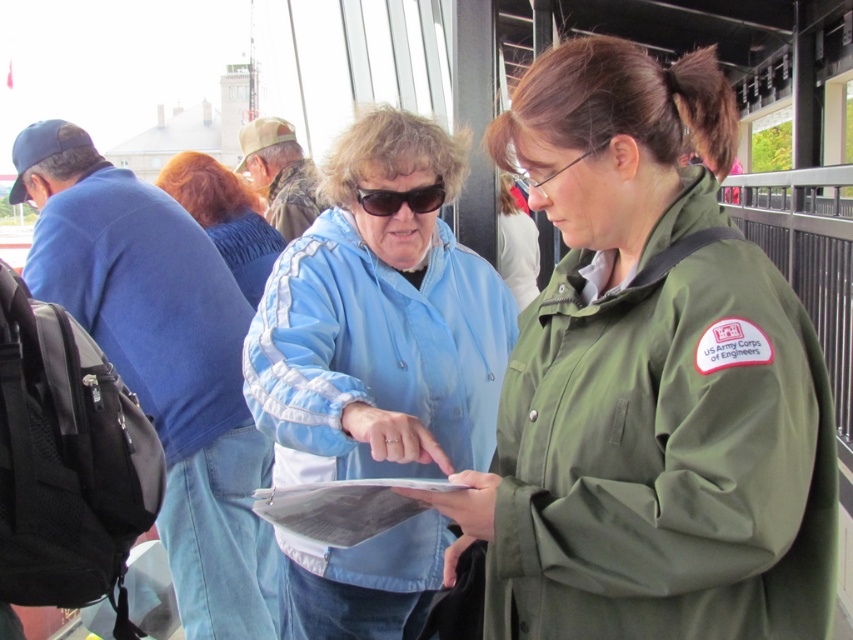
Who is more forward, (287,490) or (392,205)?

Point (287,490)

Is metallic gray clipboard at center behind black plastic sunglasses at center?

No, it is in front of black plastic sunglasses at center.

In order to click on metallic gray clipboard at center in this screenshot , I will do click(344, 508).

Which of these two, light blue fabric at center or metallic gray clipboard at center, stands taller?

With more height is light blue fabric at center.

Can you confirm if light blue fabric at center is smaller than metallic gray clipboard at center?

Actually, light blue fabric at center might be larger than metallic gray clipboard at center.

Between point (289, 339) and point (323, 524), which one is positioned behind?

The point (289, 339) is more distant.

This screenshot has height=640, width=853. I want to click on light blue fabric at center, so click(380, 323).

Can you confirm if blue fabric jacket at upper center is positioned above black plastic sunglasses at center?

Yes.

Between point (248, 220) and point (357, 198), which one is positioned behind?

The point (248, 220) is behind.

Identify the location of blue fabric jacket at upper center. This screenshot has height=640, width=853. coord(225,216).